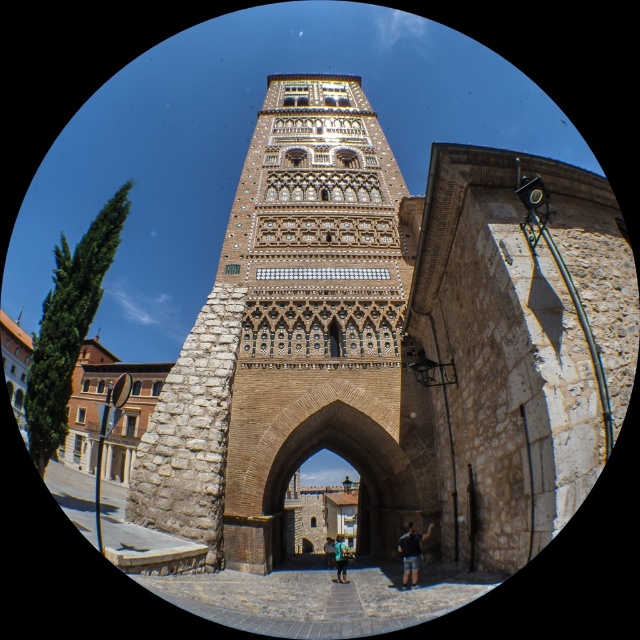
Question: Among these points, which one is farthest from the camera?

Choices:
 (A) (413, 536)
 (B) (326, 545)
 (C) (340, 568)
 (D) (264, 456)

Answer: (B)

Question: Is blue denim jeans at lower center positioned behind blue denim shorts at center?

Choices:
 (A) yes
 (B) no

Answer: (B)

Question: Does brown stone bell tower at center have a larger size compared to blue denim shorts at center?

Choices:
 (A) yes
 (B) no

Answer: (A)

Question: Among these points, which one is nearest to the camera?

Choices:
 (A) (413, 572)
 (B) (433, 548)

Answer: (A)

Question: Which is farther from the blue denim jeans at lower center?

Choices:
 (A) blue denim shorts at center
 (B) brown stone bell tower at center

Answer: (B)

Question: Can you confirm if blue denim jeans at lower center is positioned to the right of blue denim shorts at center?

Choices:
 (A) no
 (B) yes

Answer: (B)